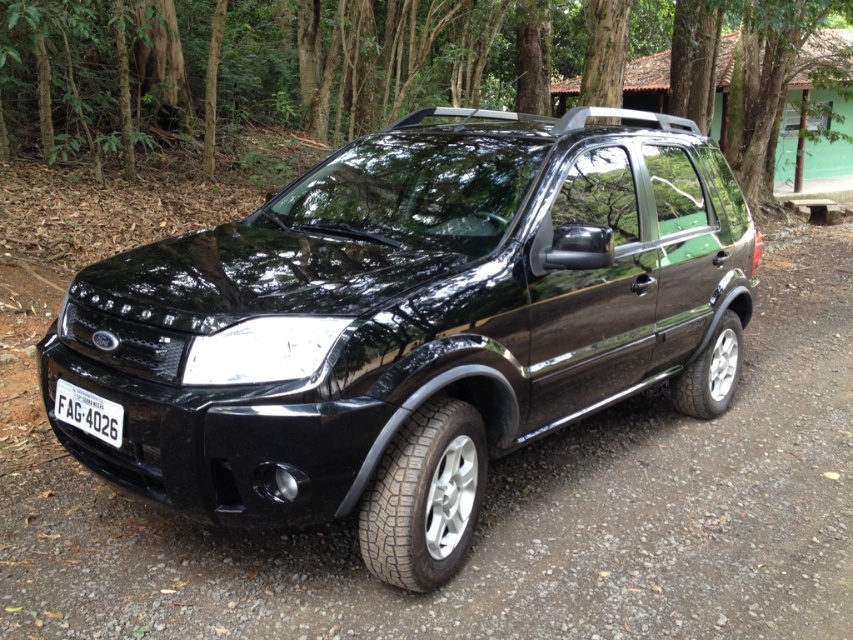
You are a drone operator flying a drone that can only hover at point coordinates. You need to capture a photo of the green leafy tree at center. What are the coordinates where you should direct the drone to hover?

The coordinates for the green leafy tree at center are at point (367, 65), so direct the drone to hover there.

In the scene shown: You are a photographer planning to take a picture of the glossy black suv at center and the green leafy tree at center. Based on their positions, will the tree appear above or below the SUV in the photo?

The glossy black suv at center is located below green leafy tree at center, so the tree will appear above the SUV in the photo.

You are a driver who wants to park your car in the same spot as the black Ford EcoSport. You notice the green leafy tree at center and the black plastic license plate at lower left. Which object is taller?

The green leafy tree at center is taller than the black plastic license plate at lower left.